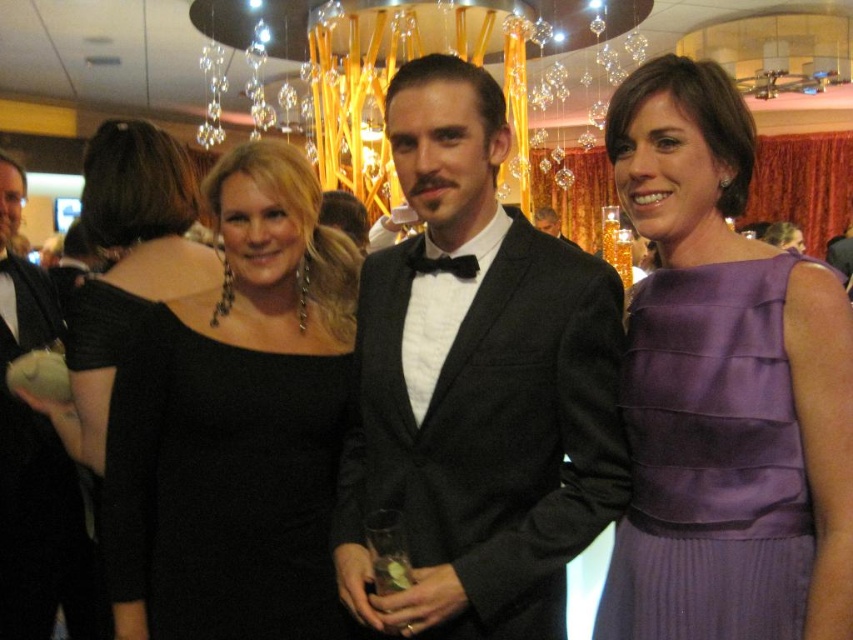
Question: Which of the following is the farthest from the observer?

Choices:
 (A) (22, 300)
 (B) (440, 264)

Answer: (A)

Question: Does purple satin dress at center appear over black satin bow tie at center?

Choices:
 (A) yes
 (B) no

Answer: (B)

Question: Is matte black suit at center wider than black satin tuxedo at center?

Choices:
 (A) no
 (B) yes

Answer: (A)

Question: Which point appears farthest from the camera in this image?

Choices:
 (A) (157, 506)
 (B) (432, 266)

Answer: (A)

Question: Which point is closer to the camera?

Choices:
 (A) (682, 259)
 (B) (567, 241)

Answer: (A)

Question: Can you confirm if black velvet tuxedo at center is positioned below purple satin dress at center?

Choices:
 (A) yes
 (B) no

Answer: (B)